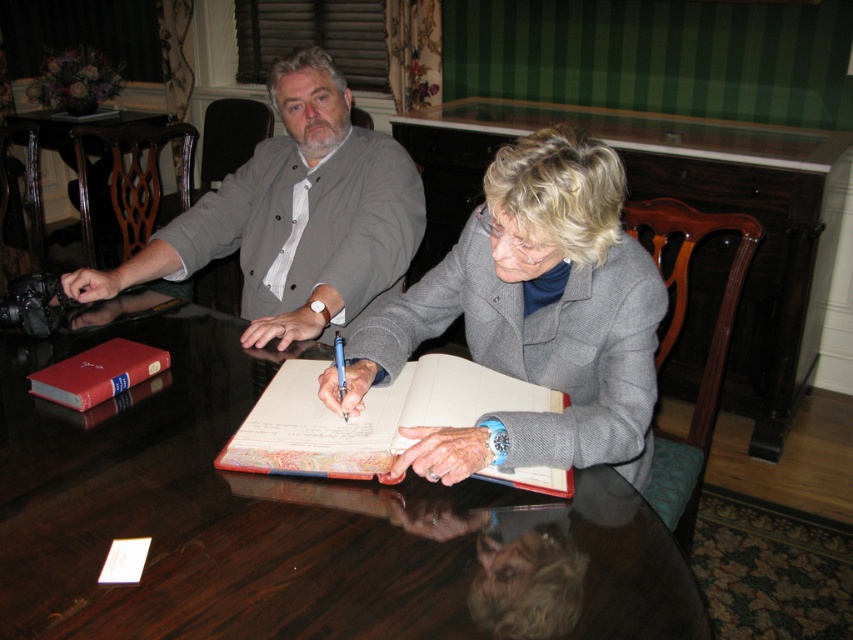
You are planning to place a rectangular gift box that is 1.2 meters long on the wooden table at center. Considering the size of the red leather book at lower left, will the gift box fit horizontally on the table?

The wooden table at center might be wider than red leather book at lower left, but since the book is only an object on the table and not part of its structure, its width does not determine the table width. Without specific table dimensions, we cannot confirm if the gift box will fit. Please check the table size directly.